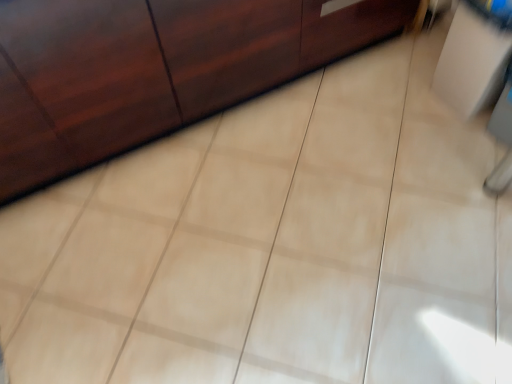
Question: Does matte wood cabinet at upper left have a lesser width compared to white glossy cabinet at upper right?

Choices:
 (A) no
 (B) yes

Answer: (A)

Question: Is matte wood cabinet at upper left taller than white glossy cabinet at upper right?

Choices:
 (A) yes
 (B) no

Answer: (A)

Question: Does matte wood cabinet at upper left have a greater width compared to white glossy cabinet at upper right?

Choices:
 (A) no
 (B) yes

Answer: (B)

Question: Is matte wood cabinet at upper left further to the viewer compared to white glossy cabinet at upper right?

Choices:
 (A) no
 (B) yes

Answer: (A)

Question: Can you confirm if matte wood cabinet at upper left is bigger than white glossy cabinet at upper right?

Choices:
 (A) no
 (B) yes

Answer: (B)

Question: Is white glossy cabinet at upper right inside matte wood cabinet at upper left?

Choices:
 (A) no
 (B) yes

Answer: (A)

Question: Does white glossy cabinet at upper right have a lesser height compared to matte wood cabinet at upper left?

Choices:
 (A) no
 (B) yes

Answer: (B)

Question: Is white glossy cabinet at upper right further to camera compared to matte wood cabinet at upper left?

Choices:
 (A) yes
 (B) no

Answer: (A)

Question: Is white glossy cabinet at upper right to the right of matte wood cabinet at upper left from the viewer's perspective?

Choices:
 (A) yes
 (B) no

Answer: (A)

Question: Would you say white glossy cabinet at upper right is a long distance from matte wood cabinet at upper left?

Choices:
 (A) no
 (B) yes

Answer: (A)

Question: Can we say white glossy cabinet at upper right lies outside matte wood cabinet at upper left?

Choices:
 (A) no
 (B) yes

Answer: (B)

Question: Does white glossy cabinet at upper right have a smaller size compared to matte wood cabinet at upper left?

Choices:
 (A) no
 (B) yes

Answer: (B)

Question: In terms of width, does matte wood cabinet at upper left look wider or thinner when compared to white glossy cabinet at upper right?

Choices:
 (A) thin
 (B) wide

Answer: (B)